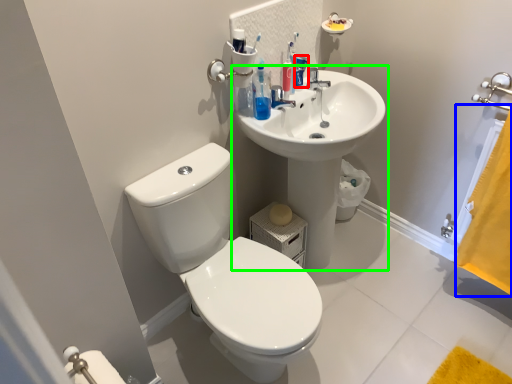
Question: Which is nearer to the toiletry (highlighted by a red box)? curtain (highlighted by a blue box) or sink (highlighted by a green box).

Choices:
 (A) curtain
 (B) sink

Answer: (B)